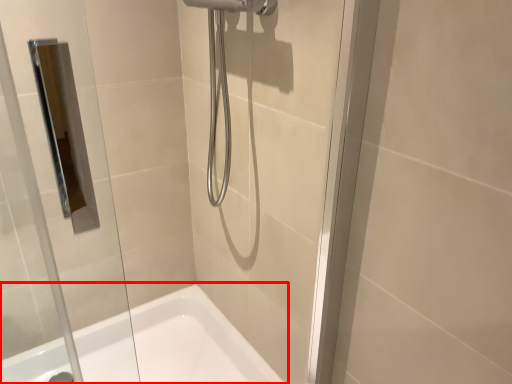
Question: From the image's perspective, what is the correct spatial relationship of bathtub (annotated by the red box) in relation to glass door?

Choices:
 (A) above
 (B) below

Answer: (B)